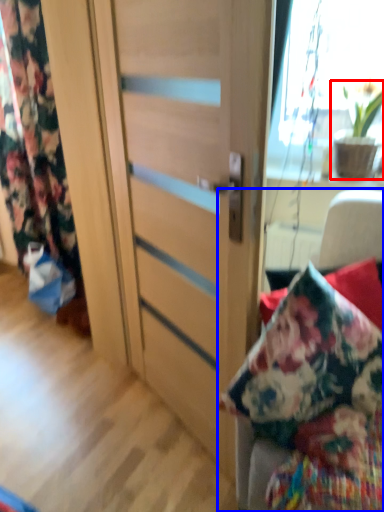
Question: Which of the following is the closest to the observer, houseplant (highlighted by a red box) or furniture (highlighted by a blue box)?

Choices:
 (A) houseplant
 (B) furniture

Answer: (B)